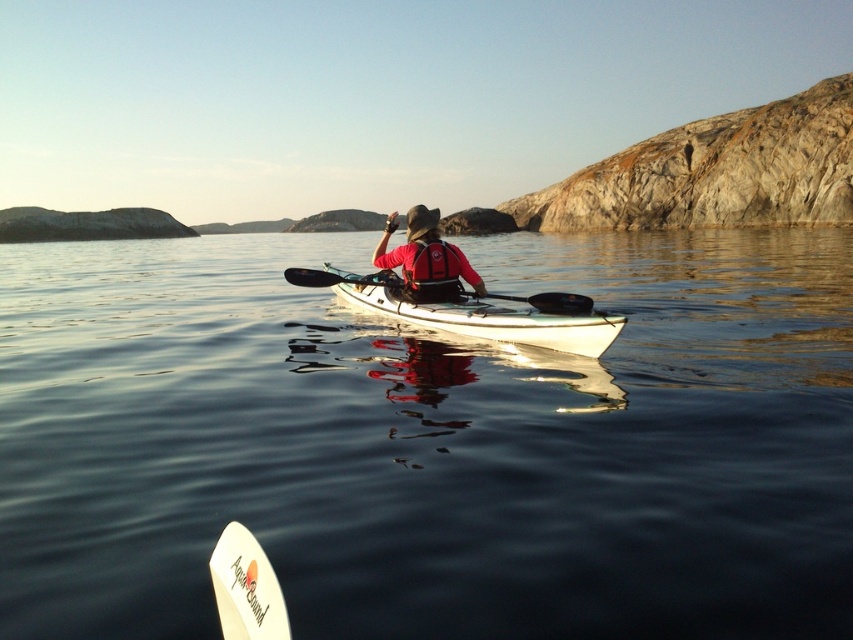
Is white foam surfboard at lower left positioned before red matte life jacket at center?

Yes, white foam surfboard at lower left is in front of red matte life jacket at center.

Does white foam surfboard at lower left have a larger size compared to red matte life jacket at center?

Actually, white foam surfboard at lower left might be smaller than red matte life jacket at center.

Which is in front, point (248, 545) or point (428, 288)?

Point (248, 545) is more forward.

Where is `white foam surfboard at lower left`? white foam surfboard at lower left is located at coordinates (247, 588).

Based on the photo, which is more to the left, white glossy canoe at center or white foam surfboard at lower left?

From the viewer's perspective, white glossy canoe at center appears more on the left side.

Does point (547, 337) come closer to viewer compared to point (260, 602)?

That is False.

Who is more distant from viewer, (508,316) or (250,573)?

Positioned behind is point (508,316).

Identify the location of white glossy canoe at center. This screenshot has width=853, height=640. (488, 317).

Can you confirm if clear water at center is positioned above white foam surfboard at lower left?

Indeed, clear water at center is positioned over white foam surfboard at lower left.

Who is positioned more to the right, clear water at center or white foam surfboard at lower left?

white foam surfboard at lower left is more to the right.

What do you see at coordinates (428, 442) in the screenshot? The width and height of the screenshot is (853, 640). I see `clear water at center` at bounding box center [428, 442].

You are a GUI agent. You are given a task and a screenshot of the screen. Output one action in this format:
    pyautogui.click(x=<x>, y=<y>)
    Task: Click on the clear water at center
    The image size is (853, 640).
    Given the screenshot: What is the action you would take?
    pyautogui.click(x=428, y=442)